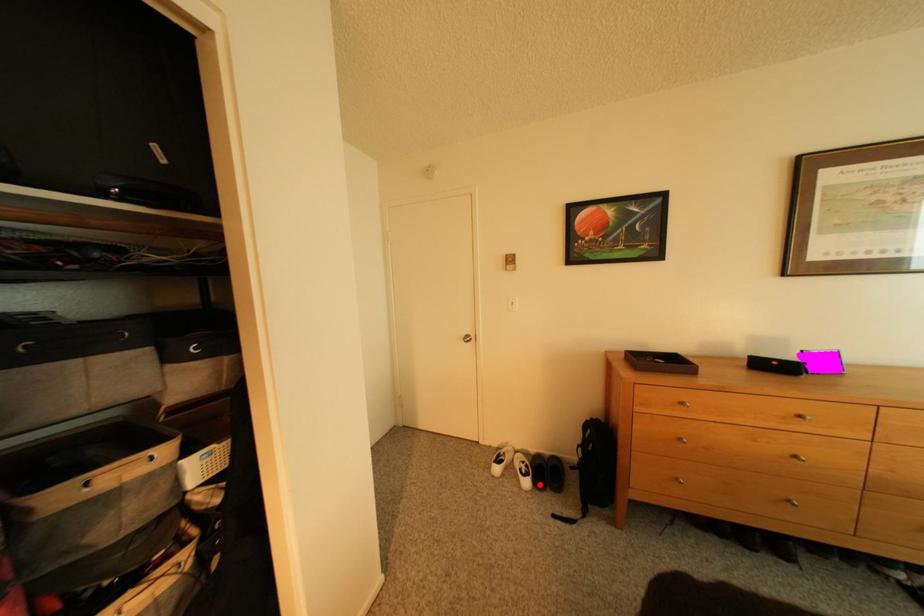
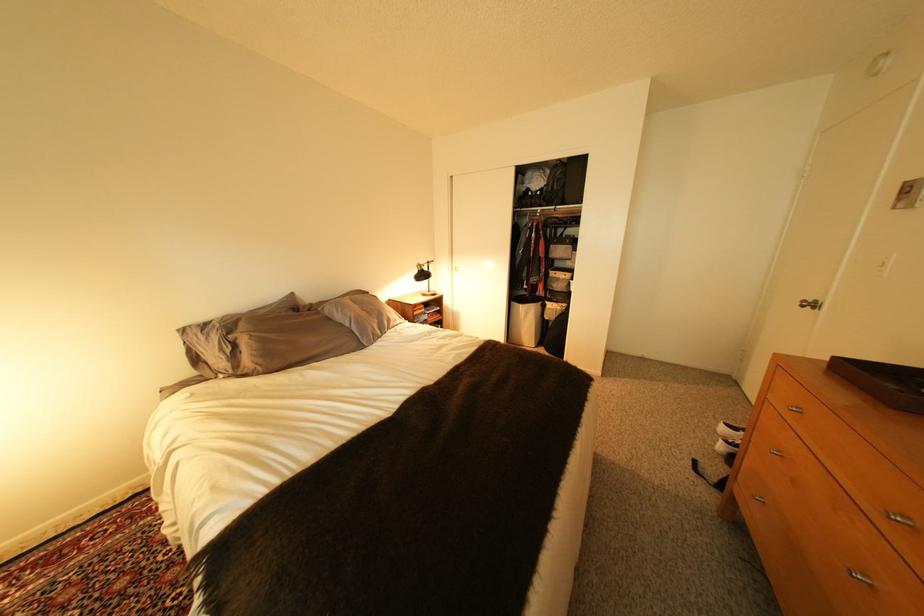
Question: I am providing you with two images of the same scene from different viewpoints. Image1 has a red point marked. In image2, the corresponding 3D location appears at what relative position? Reply with the corresponding letter.

Choices:
 (A) Closer
 (B) Farther

Answer: (B)